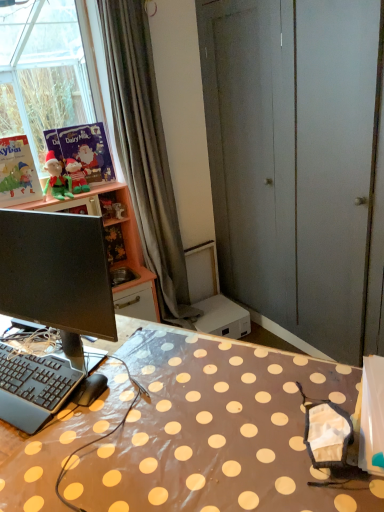
Image resolution: width=384 pixels, height=512 pixels. Identify the location of vacant area located to the right-hand side of black matte computer monitor at left. (166, 367).